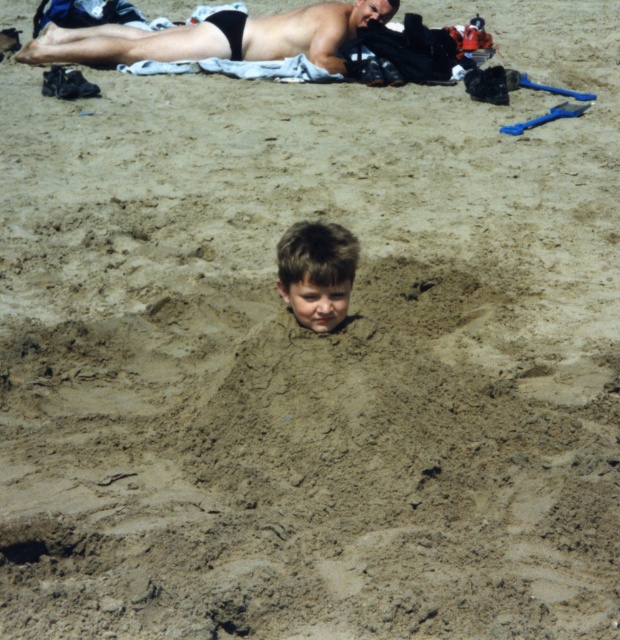
You are a photographer taking a picture of the beach scene. You notice the smooth tan skin at upper center and the light brown hair at center. Which one is positioned higher in the image?

The smooth tan skin at upper center is positioned higher than the light brown hair at center.

You are a photographer standing at the edge of the beach. You want to take a photo that includes both the smooth tan skin at upper center and the light brown hair at center. Given their distance apart, will you need to zoom in or zoom out to ensure both are in the frame?

The smooth tan skin at upper center and light brown hair at center are 15.94 feet apart. To include both in the frame, you would need to zoom out to widen the field of view.

Looking at this image, you are a photographer trying to capture a candid shot of the two people in the beach scene. You notice the smooth tan skin at upper center and the light brown hair at center. Which one is positioned more to the left side of the image?

The smooth tan skin at upper center is positioned more to the left side of the image than the light brown hair at center.